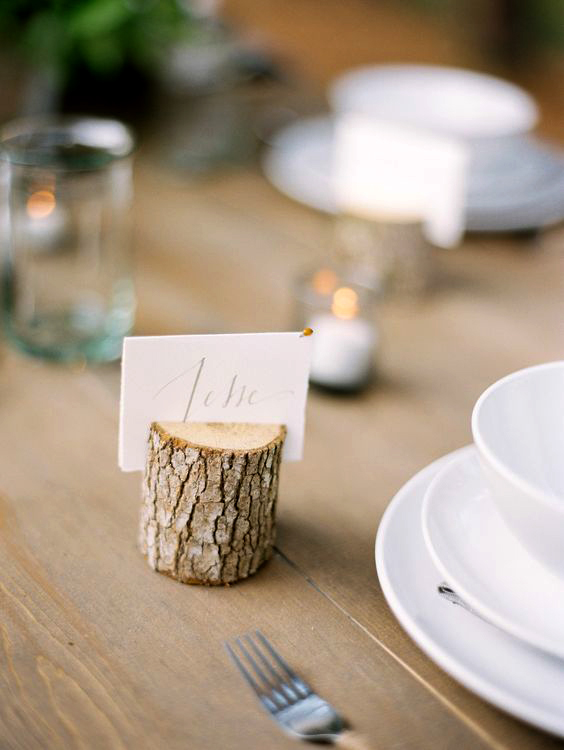
The image size is (564, 750). I want to click on fork, so click(299, 712).